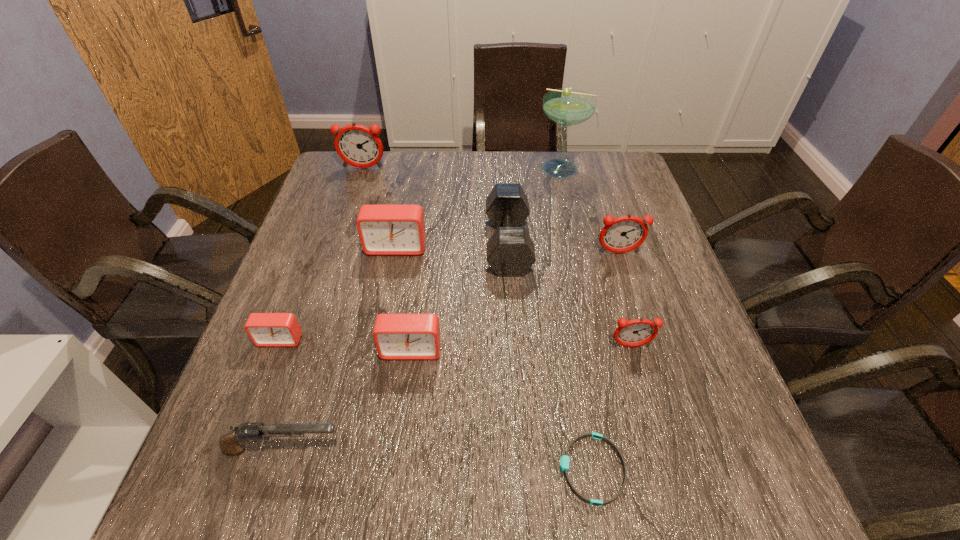
Where is `vacant point located between the gray wristband and the nearest reddish-pink alarm clock`? vacant point located between the gray wristband and the nearest reddish-pink alarm clock is located at coordinates (612, 408).

The image size is (960, 540). I want to click on free spot between the second smallest red alarm clock and the nearest reddish-pink alarm clock, so click(x=521, y=348).

Where is `free space that is in between the tallest object and the biggest red alarm clock`? free space that is in between the tallest object and the biggest red alarm clock is located at coordinates (480, 208).

This screenshot has width=960, height=540. What are the coordinates of `vacant region between the green martini and the tallest alarm clock` in the screenshot? It's located at (464, 168).

This screenshot has width=960, height=540. Find the location of `free spot between the ninth shortest object and the second smallest red alarm clock`. free spot between the ninth shortest object and the second smallest red alarm clock is located at coordinates (387, 259).

Where is `free area in between the wristband and the nearest reddish-pink alarm clock`? The height and width of the screenshot is (540, 960). free area in between the wristband and the nearest reddish-pink alarm clock is located at coordinates click(612, 408).

Where is `free space between the smallest reddish-pink alarm clock and the gray wristband`? The image size is (960, 540). free space between the smallest reddish-pink alarm clock and the gray wristband is located at coordinates (612, 408).

Where is `the second closest object to the farthest red alarm clock`? the second closest object to the farthest red alarm clock is located at coordinates point(264,329).

This screenshot has width=960, height=540. In order to click on object that is the third nearest to the biggest red alarm clock in this screenshot , I will do `click(397, 336)`.

Select which alarm clock is the fifth closest to the second smallest red alarm clock. Please provide its 2D coordinates. Your answer should be formatted as a tuple, i.e. [(x, y)], where the tuple contains the x and y coordinates of a point satisfying the conditions above.

[(358, 146)]